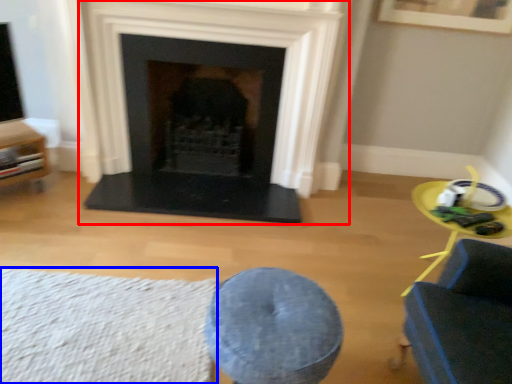
Question: Which object is closer to the camera taking this photo, fireplace (highlighted by a red box) or plain (highlighted by a blue box)?

Choices:
 (A) fireplace
 (B) plain

Answer: (B)